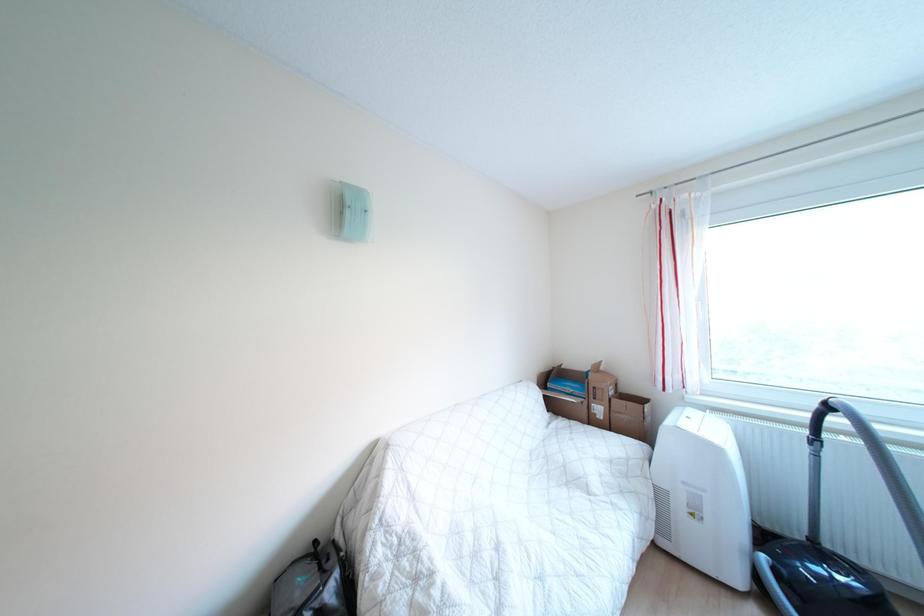
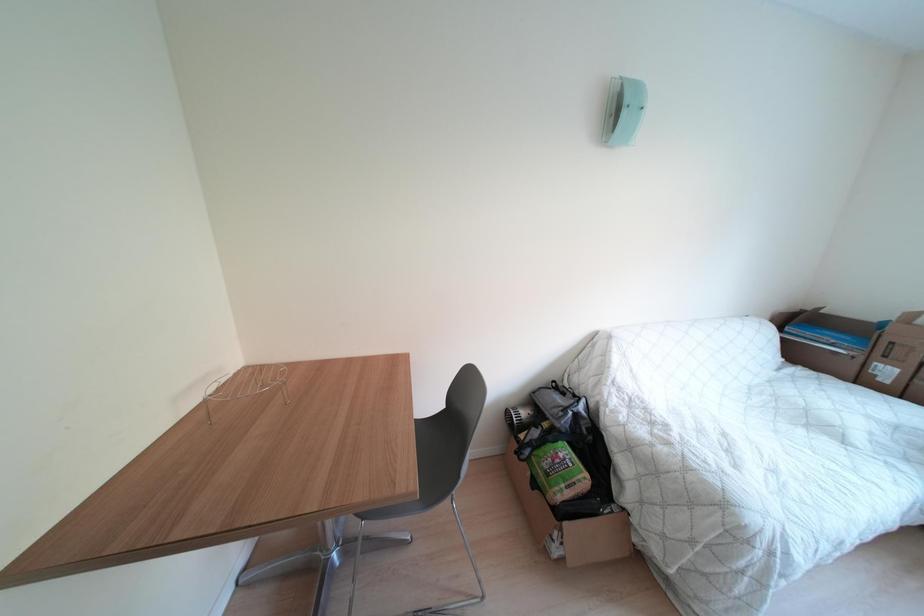
First-person continuous shooting, in which direction is the camera rotating?

The camera's rotation is toward left-down.